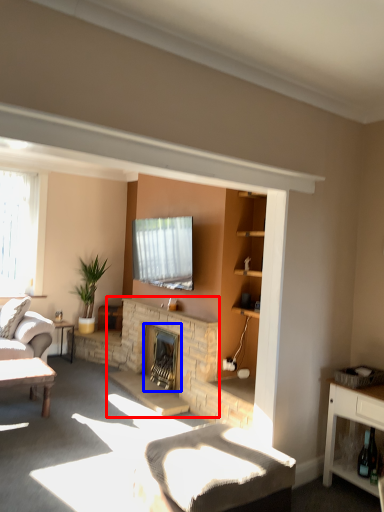
Question: Which object is further to the camera taking this photo, fireplace (highlighted by a red box) or fireplace (highlighted by a blue box)?

Choices:
 (A) fireplace
 (B) fireplace

Answer: (B)